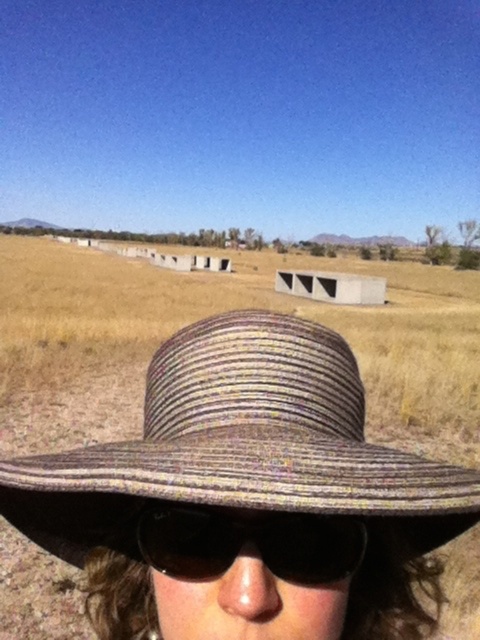
You are a photographer trying to capture the person in the image. Since both the woven straw hat at center and the black reflective sunglasses at center are at the center, which object is wider when viewed from your camera lens?

The woven straw hat at center is wider than the black reflective sunglasses at center.

You are standing at the point closest to the person in the image. Which of the two points, point [271,442] or point [186,524], is closer to you?

Point [271,442] is in front of point [186,524], so it is closer to you.

You are a photographer trying to capture the subject wearing the woven straw hat at center and black reflective sunglasses at center. If you want to focus on the sunglasses first, which object should you move your camera to the left to capture better?

The woven straw hat at center is positioned on the left side of black reflective sunglasses at center. To focus on the sunglasses first, you should move your camera to the right since the sunglasses are on the right relative to the hat.